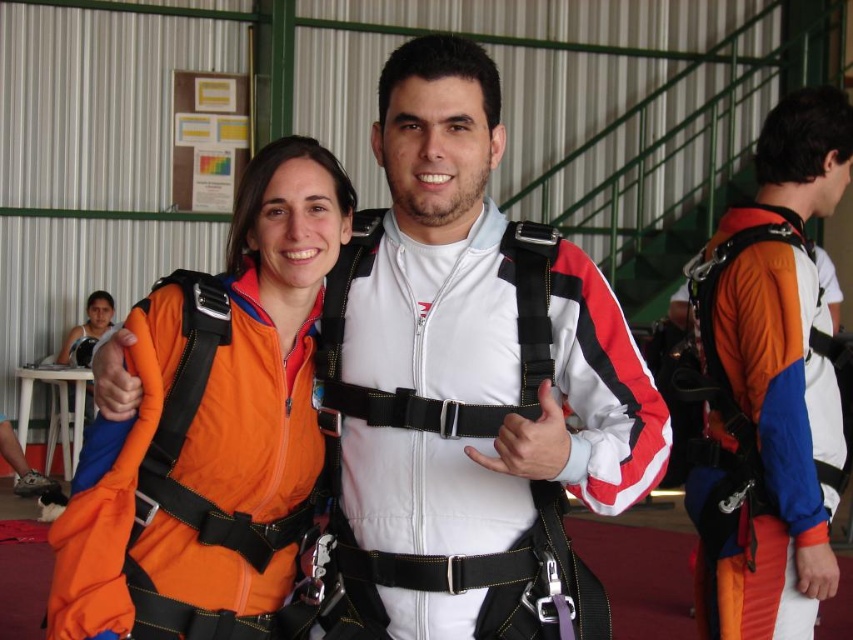
You are a photographer positioned at the entrance of the hangar. You need to capture a photo where both the white matte jumpsuit at center and the orange fabric jumpsuit at center are clearly visible. Based on their positions, which jumpsuit will appear closer to the camera in the final photo?

The white matte jumpsuit at center will appear closer to the camera because it is positioned in front of the orange fabric jumpsuit at center.

Based on the photo, you are standing at the entrance of the hangar and see two points marked in the scene. Which point, point (x=399, y=196) or point (x=276, y=337), is closer to you?

Point (x=399, y=196) is in front of point (x=276, y=337), so it is closer to you.